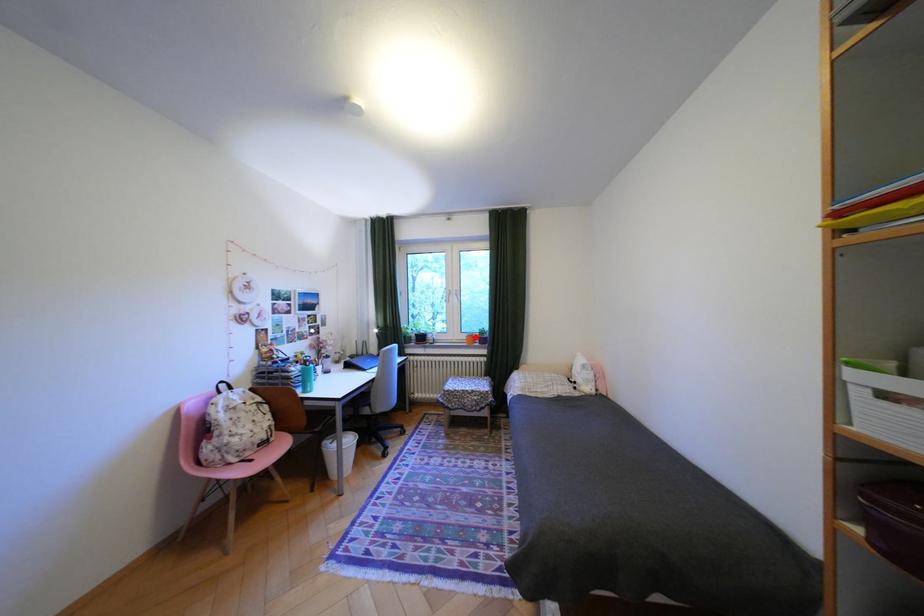
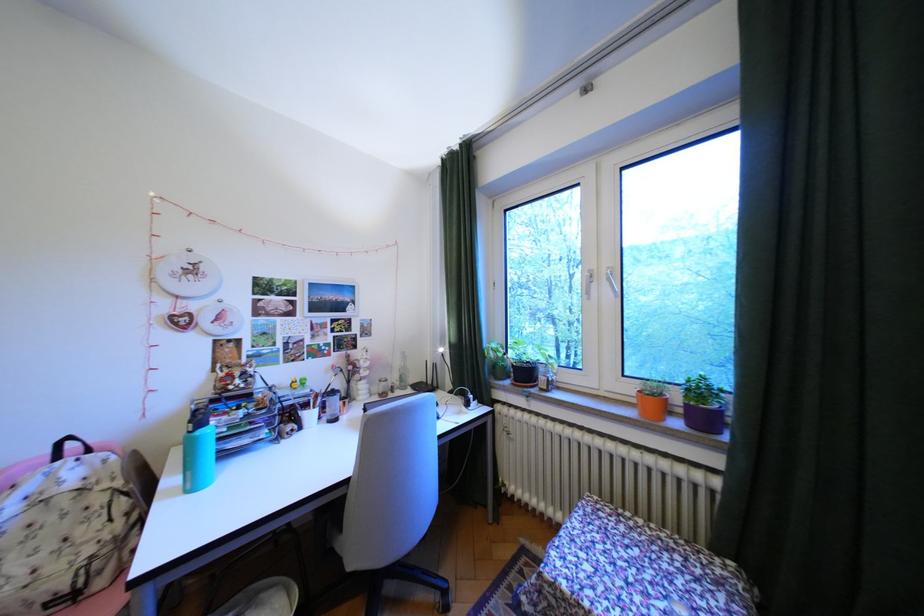
Where in the second image is the point corresponding to the highlighted location from the first image?

(641, 390)